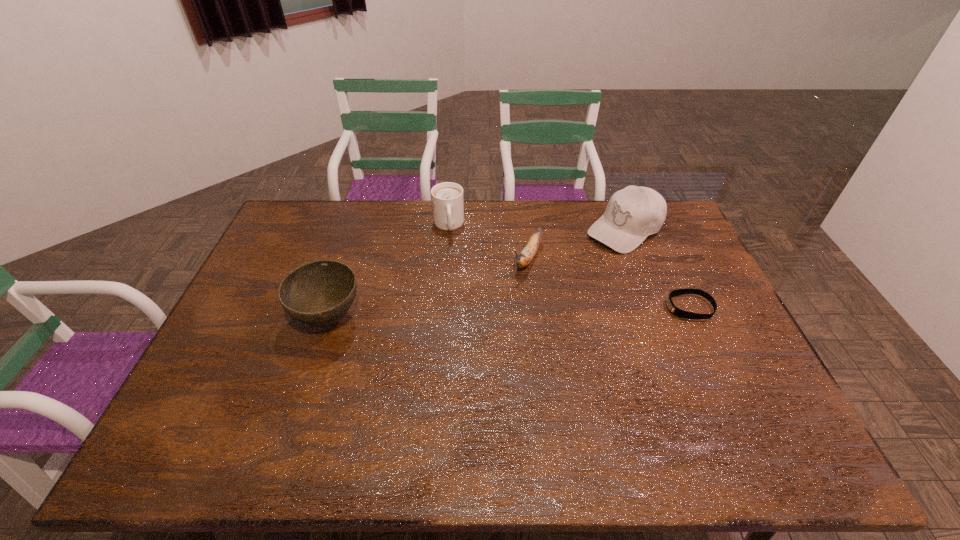
Point out which object is positioned as the third nearest to the leftmost object. Please provide its 2D coordinates. Your answer should be formatted as a tuple, i.e. [(x, y)], where the tuple contains the x and y coordinates of a point satisfying the conditions above.

[(632, 214)]

Identify which object is the nearest to the second object from left to right. Please provide its 2D coordinates. Your answer should be formatted as a tuple, i.e. [(x, y)], where the tuple contains the x and y coordinates of a point satisfying the conditions above.

[(529, 251)]

You are a GUI agent. You are given a task and a screenshot of the screen. Output one action in this format:
    pyautogui.click(x=<x>, y=<y>)
    Task: Click on the vacant space that satisfies the following two spatial constraints: 1. on the back side of the baseball cap; 2. on the left side of the second shortest object
    This screenshot has width=960, height=540.
    Given the screenshot: What is the action you would take?
    pyautogui.click(x=523, y=230)

I want to click on blank space that satisfies the following two spatial constraints: 1. on the front side of the baseball cap; 2. on the display of the shortest object, so click(x=655, y=307).

Where is `vacant area in the image that satisfies the following two spatial constraints: 1. on the front side of the shortest object; 2. on the display of the third object from right to left`? Image resolution: width=960 pixels, height=540 pixels. vacant area in the image that satisfies the following two spatial constraints: 1. on the front side of the shortest object; 2. on the display of the third object from right to left is located at coordinates (532, 307).

This screenshot has width=960, height=540. Find the location of `free space that satisfies the following two spatial constraints: 1. on the back side of the third object from right to left; 2. on the right side of the baseball cap`. free space that satisfies the following two spatial constraints: 1. on the back side of the third object from right to left; 2. on the right side of the baseball cap is located at coordinates (523, 230).

Locate an element on the screen. This screenshot has width=960, height=540. free space in the image that satisfies the following two spatial constraints: 1. on the front side of the wristband; 2. on the display of the cappuccino is located at coordinates (442, 307).

Identify the location of free location that satisfies the following two spatial constraints: 1. on the front side of the baseball cap; 2. on the display of the shortest object. [655, 307].